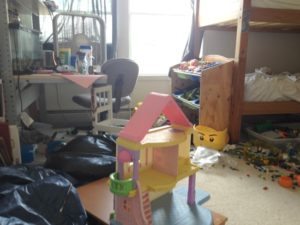
At what (x,y) coordinates should I click in order to perform the action: click on fan. Please return your answer as a coordinate pair (x, y). Looking at the image, I should click on (77, 35), (56, 21).